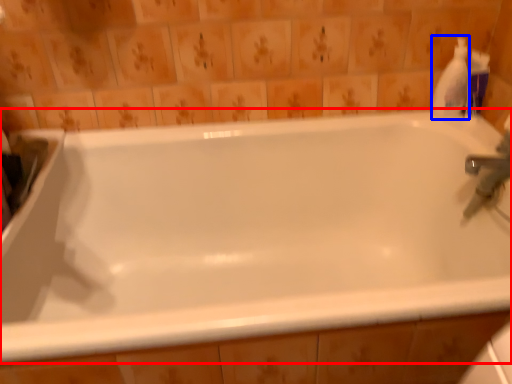
Question: Which of the following is the farthest to the observer, bathtub (highlighted by a red box) or cleaning product (highlighted by a blue box)?

Choices:
 (A) bathtub
 (B) cleaning product

Answer: (B)